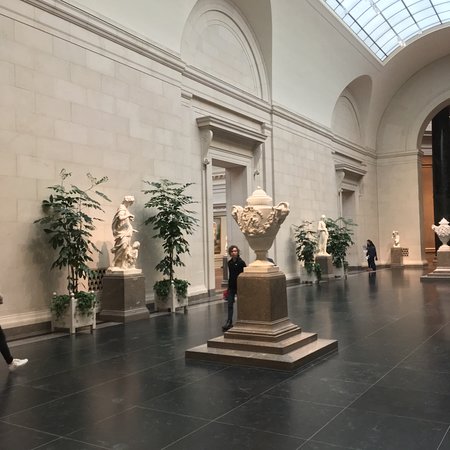
I want to click on floor, so click(370, 351).